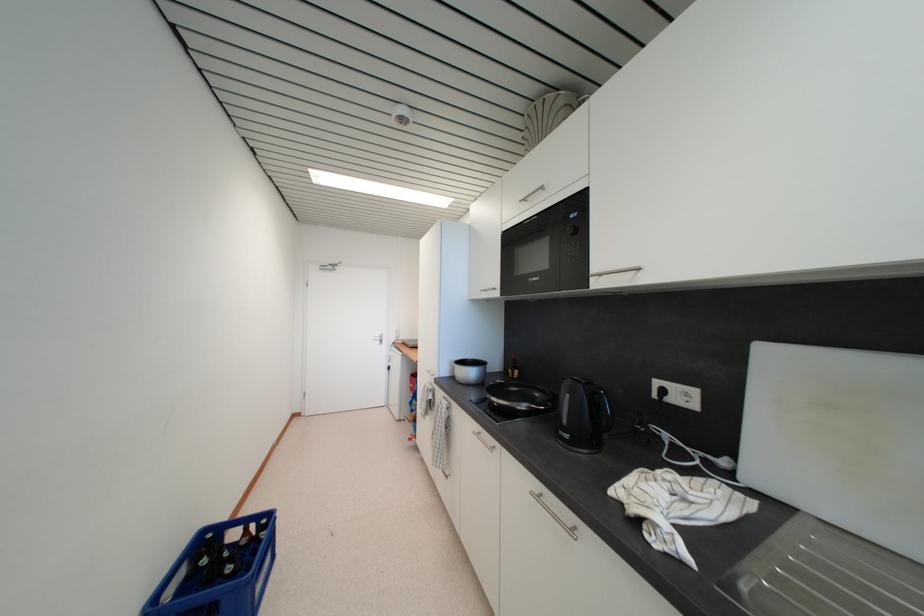
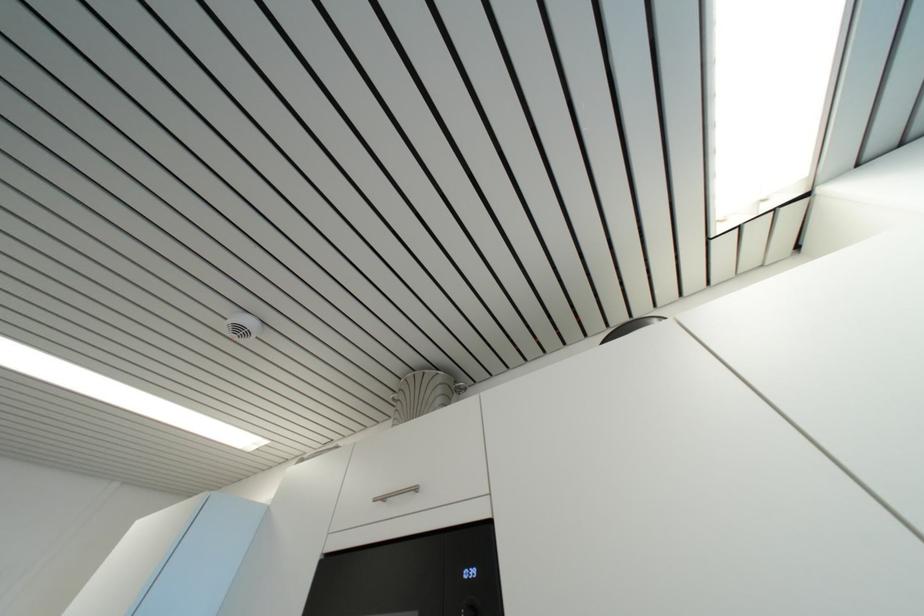
Looking at this image, how did the camera likely rotate?

The rotation direction of the camera is right-up.